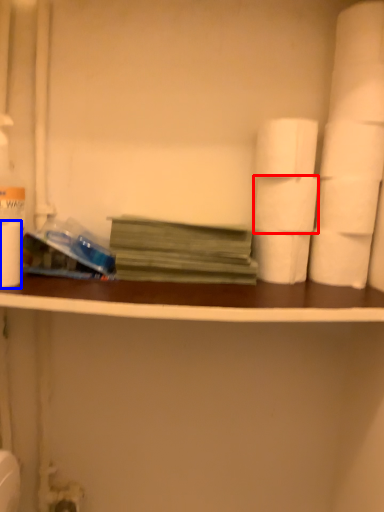
Question: Among these objects, which one is farthest to the camera, toilet paper (highlighted by a red box) or paper towel (highlighted by a blue box)?

Choices:
 (A) toilet paper
 (B) paper towel

Answer: (A)